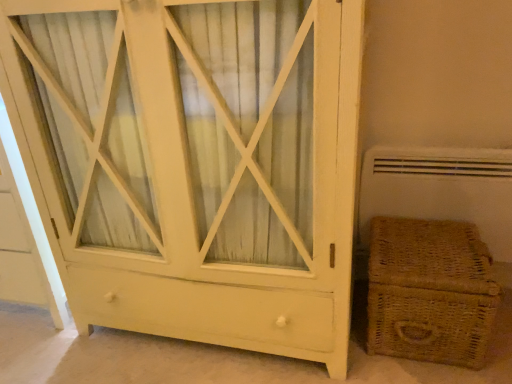
Question: Considering the positions of point (368, 311) and point (148, 92), is point (368, 311) closer or farther from the camera than point (148, 92)?

Choices:
 (A) closer
 (B) farther

Answer: (B)

Question: Is braided wicker basket at lower right in front of or behind white wood cabinet at center in the image?

Choices:
 (A) behind
 (B) front

Answer: (A)

Question: Considering the positions of braided wicker basket at lower right and white wood cabinet at center in the image, is braided wicker basket at lower right wider or thinner than white wood cabinet at center?

Choices:
 (A) thin
 (B) wide

Answer: (A)

Question: In the image, is white wood cabinet at center on the left side or the right side of braided wicker basket at lower right?

Choices:
 (A) left
 (B) right

Answer: (A)

Question: Is white wood cabinet at center bigger or smaller than braided wicker basket at lower right?

Choices:
 (A) small
 (B) big

Answer: (B)

Question: From a real-world perspective, is white wood cabinet at center positioned above or below braided wicker basket at lower right?

Choices:
 (A) above
 (B) below

Answer: (A)

Question: Is white wood cabinet at center inside or outside of braided wicker basket at lower right?

Choices:
 (A) outside
 (B) inside

Answer: (A)